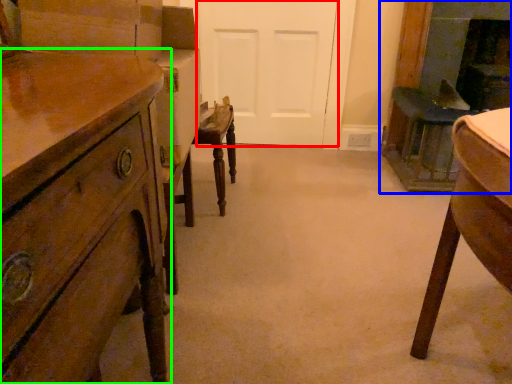
Question: Which object is positioned closest to door (highlighted by a red box)? Select from fireplace (highlighted by a blue box) and chest of drawers (highlighted by a green box).

Choices:
 (A) fireplace
 (B) chest of drawers

Answer: (A)